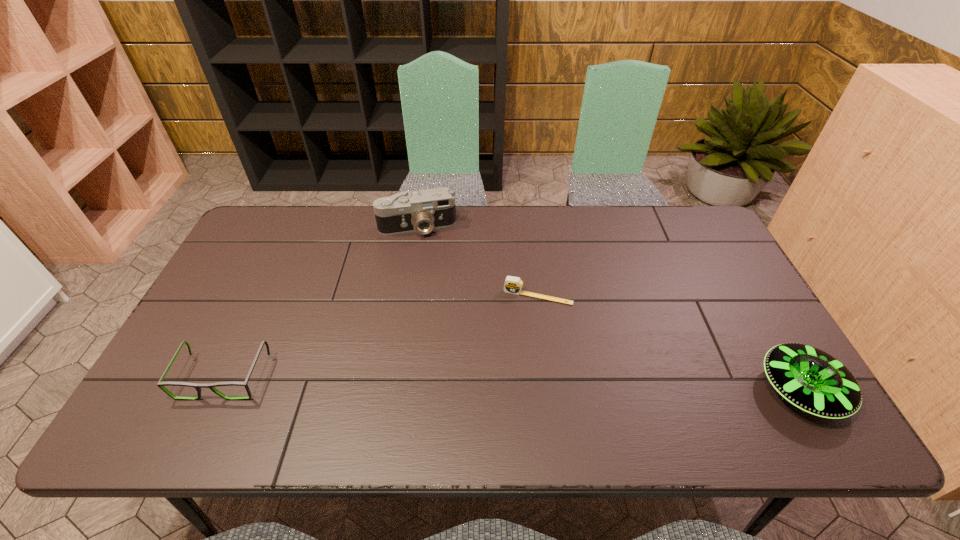
Where is `object positioned at the near left corner`? The height and width of the screenshot is (540, 960). object positioned at the near left corner is located at coordinates (160, 384).

The height and width of the screenshot is (540, 960). I want to click on object that is at the near right corner, so click(x=810, y=379).

Locate an element on the screen. vacant space at the far edge is located at coordinates (649, 241).

Locate an element on the screen. The image size is (960, 540). vacant space at the near edge of the desktop is located at coordinates (658, 383).

Locate an element on the screen. vacant space at the right edge is located at coordinates (738, 319).

Locate an element on the screen. The image size is (960, 540). free space at the far left corner is located at coordinates tap(244, 239).

Identify the location of free space at the near right corner. (750, 382).

Identify the location of vacant area between the saucer and the third tallest object. This screenshot has height=540, width=960. (513, 383).

Where is `vacant space that's between the tallest object and the spectacles`? This screenshot has height=540, width=960. vacant space that's between the tallest object and the spectacles is located at coordinates (321, 302).

The width and height of the screenshot is (960, 540). In order to click on free space between the tape measure and the rightmost object in this screenshot , I will do `click(669, 343)`.